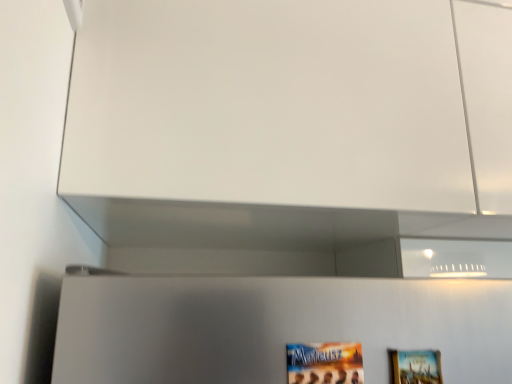
In order to click on wooden picture frame at lower right in this screenshot , I will do `click(416, 367)`.

Describe the element at coordinates (416, 367) in the screenshot. I see `wooden picture frame at lower right` at that location.

Locate an element on the screen. Image resolution: width=512 pixels, height=384 pixels. matte paper movie poster at lower center is located at coordinates (325, 363).

The image size is (512, 384). Describe the element at coordinates (325, 363) in the screenshot. I see `matte paper movie poster at lower center` at that location.

Locate an element on the screen. The height and width of the screenshot is (384, 512). wooden picture frame at lower right is located at coordinates (416, 367).

Considering the relative positions of wooden picture frame at lower right and matte paper movie poster at lower center in the image provided, is wooden picture frame at lower right to the right of matte paper movie poster at lower center from the viewer's perspective?

Yes, wooden picture frame at lower right is to the right of matte paper movie poster at lower center.

Is wooden picture frame at lower right closer to the viewer compared to matte paper movie poster at lower center?

No, wooden picture frame at lower right is further to the viewer.

Which point is more distant from viewer, (418,378) or (350,366)?

The point (418,378) is more distant.

From the image's perspective, which one is positioned lower, wooden picture frame at lower right or matte paper movie poster at lower center?

wooden picture frame at lower right appears lower in the image.

From a real-world perspective, is wooden picture frame at lower right above or below matte paper movie poster at lower center?

From a real-world perspective, wooden picture frame at lower right is physically above matte paper movie poster at lower center.

Does wooden picture frame at lower right have a lesser width compared to matte paper movie poster at lower center?

In fact, wooden picture frame at lower right might be wider than matte paper movie poster at lower center.

Can you confirm if wooden picture frame at lower right is shorter than matte paper movie poster at lower center?

Incorrect, the height of wooden picture frame at lower right does not fall short of that of matte paper movie poster at lower center.

Considering the relative sizes of wooden picture frame at lower right and matte paper movie poster at lower center in the image provided, is wooden picture frame at lower right smaller than matte paper movie poster at lower center?

Incorrect, wooden picture frame at lower right is not smaller in size than matte paper movie poster at lower center.

Would you say wooden picture frame at lower right is outside matte paper movie poster at lower center?

That's correct, wooden picture frame at lower right is outside of matte paper movie poster at lower center.

Is wooden picture frame at lower right not near matte paper movie poster at lower center?

Actually, wooden picture frame at lower right and matte paper movie poster at lower center are a little close together.

Could you tell me if wooden picture frame at lower right is facing matte paper movie poster at lower center?

No, wooden picture frame at lower right is not oriented towards matte paper movie poster at lower center.

Can you tell me how much wooden picture frame at lower right and matte paper movie poster at lower center differ in facing direction?

There is a 0.0025-degree angle between the facing directions of wooden picture frame at lower right and matte paper movie poster at lower center.

How far apart are wooden picture frame at lower right and matte paper movie poster at lower center?

wooden picture frame at lower right is 3.17 inches from matte paper movie poster at lower center.

Find the location of `movie poster in front of the wooden picture frame at lower right`. movie poster in front of the wooden picture frame at lower right is located at coordinates (325, 363).

Considering the relative positions of matte paper movie poster at lower center and wooden picture frame at lower right in the image provided, is matte paper movie poster at lower center to the left or to the right of wooden picture frame at lower right?

matte paper movie poster at lower center is positioned on wooden picture frame at lower right's left side.

In the image, is matte paper movie poster at lower center positioned in front of or behind wooden picture frame at lower right?

matte paper movie poster at lower center is in front of wooden picture frame at lower right.

Which is closer to the camera, [320,379] or [432,355]?

Point [320,379] appears to be closer to the viewer than point [432,355].

From the image's perspective, is matte paper movie poster at lower center above wooden picture frame at lower right?

Yes, from the image's perspective, matte paper movie poster at lower center is on top of wooden picture frame at lower right.

From a real-world perspective, between matte paper movie poster at lower center and wooden picture frame at lower right, who is vertically higher?

wooden picture frame at lower right is physically above.

Considering the sizes of objects matte paper movie poster at lower center and wooden picture frame at lower right in the image provided, who is wider, matte paper movie poster at lower center or wooden picture frame at lower right?

wooden picture frame at lower right is wider.

Considering the sizes of objects matte paper movie poster at lower center and wooden picture frame at lower right in the image provided, who is shorter, matte paper movie poster at lower center or wooden picture frame at lower right?

matte paper movie poster at lower center is shorter.

Considering the relative sizes of matte paper movie poster at lower center and wooden picture frame at lower right in the image provided, is matte paper movie poster at lower center smaller than wooden picture frame at lower right?

Correct, matte paper movie poster at lower center occupies less space than wooden picture frame at lower right.

Which is correct: matte paper movie poster at lower center is inside wooden picture frame at lower right, or outside of it?

matte paper movie poster at lower center lies outside wooden picture frame at lower right.

Are matte paper movie poster at lower center and wooden picture frame at lower right located far from each other?

No, matte paper movie poster at lower center is not far away from wooden picture frame at lower right.

Is wooden picture frame at lower right at the back of matte paper movie poster at lower center?

No, matte paper movie poster at lower center is not facing away from wooden picture frame at lower right.

How different are the orientations of matte paper movie poster at lower center and wooden picture frame at lower right in degrees?

The angular difference between matte paper movie poster at lower center and wooden picture frame at lower right is 0.0025 degrees.

Measure the distance from matte paper movie poster at lower center to wooden picture frame at lower right.

They are 3.17 inches apart.

In the image, there is a wooden picture frame at lower right. Identify the location of movie poster below it (from a real-world perspective). (325, 363).

Identify the location of picture frame that is on the right side of matte paper movie poster at lower center. This screenshot has height=384, width=512. (416, 367).

This screenshot has width=512, height=384. Find the location of `movie poster in front of the wooden picture frame at lower right`. movie poster in front of the wooden picture frame at lower right is located at coordinates (325, 363).